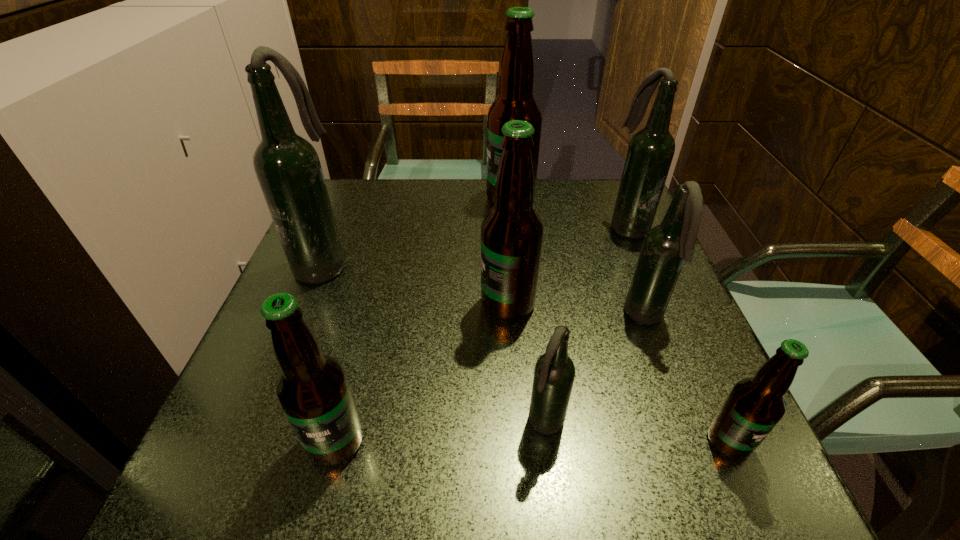
You are a GUI agent. You are given a task and a screenshot of the screen. Output one action in this format:
    pyautogui.click(x=<x>, y=<y>)
    Task: Click on the vacant space located 0.090m on the label of the third nearest brown beer bottle
    Image resolution: width=960 pixels, height=540 pixels.
    Given the screenshot: What is the action you would take?
    pyautogui.click(x=437, y=304)

Locate an element on the screen. This screenshot has height=540, width=960. free location located on the back of the third farthest dark beer bottle is located at coordinates (628, 273).

What are the coordinates of `vacant region located 0.380m on the left of the smallest dark beer bottle` in the screenshot? It's located at (288, 424).

Where is `vacant space situated 0.050m on the label of the rightmost brown beer bottle`? Image resolution: width=960 pixels, height=540 pixels. vacant space situated 0.050m on the label of the rightmost brown beer bottle is located at coordinates (754, 497).

Identify the location of object that is at the near left corner. This screenshot has width=960, height=540. pos(312,389).

Where is `object situated at the far right corner`? This screenshot has height=540, width=960. object situated at the far right corner is located at coordinates pos(651,150).

Locate an element on the screen. The width and height of the screenshot is (960, 540). object present at the near right corner is located at coordinates (754, 406).

In order to click on vacant region at the far edge of the desktop in this screenshot , I will do `click(484, 179)`.

I want to click on blank space at the near edge, so click(409, 475).

Find the location of a particular element. vacant space at the right edge is located at coordinates (702, 352).